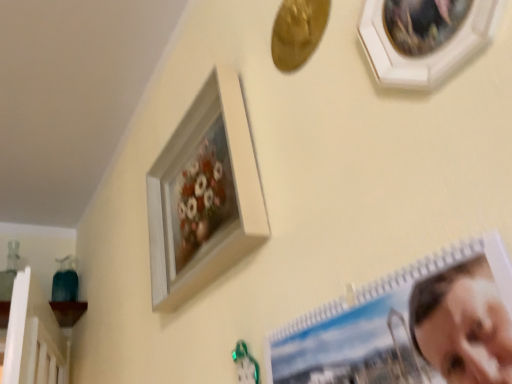
This screenshot has width=512, height=384. Identify the location of spiral-bound photo album at lower right, arranged as the first picture frame when viewed from the front. (410, 326).

This screenshot has width=512, height=384. I want to click on white wooden picture frame at upper right, which appears as the 2th picture frame when viewed from the front, so click(426, 54).

Identify the location of spiral-bound photo album at lower right, arranged as the first picture frame when viewed from the front. (x=410, y=326).

Is white matte picture frame at upper center, which ranks as the 1th picture frame in back-to-front order, outside of spiral-bound photo album at lower right, arranged as the first picture frame when viewed from the front?

Indeed, white matte picture frame at upper center, which ranks as the 1th picture frame in back-to-front order, is completely outside spiral-bound photo album at lower right, arranged as the first picture frame when viewed from the front.

Are white matte picture frame at upper center, the 3th picture frame in the front-to-back sequence, and spiral-bound photo album at lower right, arranged as the first picture frame when viewed from the front, located far from each other?

No, white matte picture frame at upper center, the 3th picture frame in the front-to-back sequence, is not far from spiral-bound photo album at lower right, arranged as the first picture frame when viewed from the front.

Is the position of white matte picture frame at upper center, which ranks as the 1th picture frame in back-to-front order, less distant than that of spiral-bound photo album at lower right, arranged as the first picture frame when viewed from the front?

No, the depth of white matte picture frame at upper center, which ranks as the 1th picture frame in back-to-front order, is greater than that of spiral-bound photo album at lower right, arranged as the first picture frame when viewed from the front.

Between white matte picture frame at upper center, which ranks as the 1th picture frame in back-to-front order, and spiral-bound photo album at lower right, arranged as the first picture frame when viewed from the front, which one has less height?

white matte picture frame at upper center, which ranks as the 1th picture frame in back-to-front order, is shorter.

Is there a large distance between white matte picture frame at upper center, which ranks as the 1th picture frame in back-to-front order, and white wooden picture frame at upper right, which appears as the 2th picture frame when viewed from the front?

They are positioned close to each other.

In the scene shown: From a real-world perspective, between white matte picture frame at upper center, which ranks as the 1th picture frame in back-to-front order, and white wooden picture frame at upper right, the second picture frame when ordered from back to front, who is vertically higher?

In real-world perspective, white matte picture frame at upper center, which ranks as the 1th picture frame in back-to-front order, is above.

From the image's perspective, between white matte picture frame at upper center, which ranks as the 1th picture frame in back-to-front order, and white wooden picture frame at upper right, the second picture frame when ordered from back to front, which one is located above?

white wooden picture frame at upper right, the second picture frame when ordered from back to front, is shown above in the image.

Which of these two, white matte picture frame at upper center, the 3th picture frame in the front-to-back sequence, or white wooden picture frame at upper right, the second picture frame when ordered from back to front, is bigger?

Bigger between the two is white matte picture frame at upper center, the 3th picture frame in the front-to-back sequence.

Considering the relative sizes of white wooden picture frame at upper right, which appears as the 2th picture frame when viewed from the front, and spiral-bound photo album at lower right, arranged as the first picture frame when viewed from the front, in the image provided, is white wooden picture frame at upper right, which appears as the 2th picture frame when viewed from the front, wider than spiral-bound photo album at lower right, arranged as the first picture frame when viewed from the front,?

No.

Considering the sizes of objects white wooden picture frame at upper right, which appears as the 2th picture frame when viewed from the front, and spiral-bound photo album at lower right, placed as the third picture frame when sorted from back to front, in the image provided, who is smaller, white wooden picture frame at upper right, which appears as the 2th picture frame when viewed from the front, or spiral-bound photo album at lower right, placed as the third picture frame when sorted from back to front,?

With smaller size is white wooden picture frame at upper right, which appears as the 2th picture frame when viewed from the front.

The height and width of the screenshot is (384, 512). There is a spiral-bound photo album at lower right, arranged as the first picture frame when viewed from the front. Identify the location of the 2nd picture frame above it (from the image's perspective). (426, 54).

Is point (402, 67) behind point (383, 315)?

That is True.

From a real-world perspective, which object rests below the other?

From a 3D spatial view, spiral-bound photo album at lower right, arranged as the first picture frame when viewed from the front, is below.

Is spiral-bound photo album at lower right, placed as the third picture frame when sorted from back to front, bigger than white wooden picture frame at upper right, the second picture frame when ordered from back to front?

Correct, spiral-bound photo album at lower right, placed as the third picture frame when sorted from back to front, is larger in size than white wooden picture frame at upper right, the second picture frame when ordered from back to front.

Considering the relative positions of spiral-bound photo album at lower right, placed as the third picture frame when sorted from back to front, and white wooden picture frame at upper right, which appears as the 2th picture frame when viewed from the front, in the image provided, is spiral-bound photo album at lower right, placed as the third picture frame when sorted from back to front, to the right of white wooden picture frame at upper right, which appears as the 2th picture frame when viewed from the front, from the viewer's perspective?

Incorrect, spiral-bound photo album at lower right, placed as the third picture frame when sorted from back to front, is not on the right side of white wooden picture frame at upper right, which appears as the 2th picture frame when viewed from the front.

Does spiral-bound photo album at lower right, arranged as the first picture frame when viewed from the front, have a lesser height compared to white wooden picture frame at upper right, the second picture frame when ordered from back to front?

No.

Are spiral-bound photo album at lower right, placed as the third picture frame when sorted from back to front, and white matte picture frame at upper center, the 3th picture frame in the front-to-back sequence, making contact?

There is a gap between spiral-bound photo album at lower right, placed as the third picture frame when sorted from back to front, and white matte picture frame at upper center, the 3th picture frame in the front-to-back sequence.

From the image's perspective, would you say spiral-bound photo album at lower right, placed as the third picture frame when sorted from back to front, is shown under white matte picture frame at upper center, the 3th picture frame in the front-to-back sequence?

Correct, spiral-bound photo album at lower right, placed as the third picture frame when sorted from back to front, appears lower than white matte picture frame at upper center, the 3th picture frame in the front-to-back sequence, in the image.

Looking at their sizes, would you say spiral-bound photo album at lower right, placed as the third picture frame when sorted from back to front, is wider or thinner than white matte picture frame at upper center, which ranks as the 1th picture frame in back-to-front order?

Considering their sizes, spiral-bound photo album at lower right, placed as the third picture frame when sorted from back to front, looks slimmer than white matte picture frame at upper center, which ranks as the 1th picture frame in back-to-front order.

From their relative heights in the image, would you say spiral-bound photo album at lower right, placed as the third picture frame when sorted from back to front, is taller or shorter than white matte picture frame at upper center, which ranks as the 1th picture frame in back-to-front order?

Considering their sizes, spiral-bound photo album at lower right, placed as the third picture frame when sorted from back to front, has more height than white matte picture frame at upper center, which ranks as the 1th picture frame in back-to-front order.

Is white wooden picture frame at upper right, the second picture frame when ordered from back to front, to the left of white matte picture frame at upper center, the 3th picture frame in the front-to-back sequence, from the viewer's perspective?

Incorrect, white wooden picture frame at upper right, the second picture frame when ordered from back to front, is not on the left side of white matte picture frame at upper center, the 3th picture frame in the front-to-back sequence.

Can you see white wooden picture frame at upper right, the second picture frame when ordered from back to front, touching white matte picture frame at upper center, which ranks as the 1th picture frame in back-to-front order?

white wooden picture frame at upper right, the second picture frame when ordered from back to front, and white matte picture frame at upper center, which ranks as the 1th picture frame in back-to-front order, are not in contact.

Does white wooden picture frame at upper right, which appears as the 2th picture frame when viewed from the front, have a greater height compared to white matte picture frame at upper center, which ranks as the 1th picture frame in back-to-front order?

No, white wooden picture frame at upper right, which appears as the 2th picture frame when viewed from the front, is not taller than white matte picture frame at upper center, which ranks as the 1th picture frame in back-to-front order.

Is the depth of white wooden picture frame at upper right, which appears as the 2th picture frame when viewed from the front, less than that of white matte picture frame at upper center, the 3th picture frame in the front-to-back sequence?

Yes, white wooden picture frame at upper right, which appears as the 2th picture frame when viewed from the front, is closer to the viewer.

Identify the location of picture frame located below the white matte picture frame at upper center, which ranks as the 1th picture frame in back-to-front order (from the image's perspective). This screenshot has width=512, height=384. (410, 326).

The height and width of the screenshot is (384, 512). What are the coordinates of `picture frame behind the white wooden picture frame at upper right, which appears as the 2th picture frame when viewed from the front` in the screenshot? It's located at (204, 194).

From the image, which object appears to be nearer to spiral-bound photo album at lower right, arranged as the first picture frame when viewed from the front, white matte picture frame at upper center, which ranks as the 1th picture frame in back-to-front order, or white wooden picture frame at upper right, which appears as the 2th picture frame when viewed from the front?

Based on the image, white wooden picture frame at upper right, which appears as the 2th picture frame when viewed from the front, appears to be nearer to spiral-bound photo album at lower right, arranged as the first picture frame when viewed from the front.

Based on their spatial positions, is spiral-bound photo album at lower right, placed as the third picture frame when sorted from back to front, or white matte picture frame at upper center, which ranks as the 1th picture frame in back-to-front order, further from white wooden picture frame at upper right, which appears as the 2th picture frame when viewed from the front?

white matte picture frame at upper center, which ranks as the 1th picture frame in back-to-front order.

Estimate the real-world distances between objects in this image. Which object is closer to white matte picture frame at upper center, the 3th picture frame in the front-to-back sequence, white wooden picture frame at upper right, which appears as the 2th picture frame when viewed from the front, or spiral-bound photo album at lower right, placed as the third picture frame when sorted from back to front?

The object closer to white matte picture frame at upper center, the 3th picture frame in the front-to-back sequence, is spiral-bound photo album at lower right, placed as the third picture frame when sorted from back to front.

From the image, which object appears to be farther from spiral-bound photo album at lower right, placed as the third picture frame when sorted from back to front, white wooden picture frame at upper right, the second picture frame when ordered from back to front, or white matte picture frame at upper center, which ranks as the 1th picture frame in back-to-front order?

Based on the image, white matte picture frame at upper center, which ranks as the 1th picture frame in back-to-front order, appears to be further to spiral-bound photo album at lower right, placed as the third picture frame when sorted from back to front.

From the image, which object appears to be nearer to white wooden picture frame at upper right, which appears as the 2th picture frame when viewed from the front, white matte picture frame at upper center, the 3th picture frame in the front-to-back sequence, or spiral-bound photo album at lower right, arranged as the first picture frame when viewed from the front?

spiral-bound photo album at lower right, arranged as the first picture frame when viewed from the front.

From the image, which object appears to be nearer to white matte picture frame at upper center, the 3th picture frame in the front-to-back sequence, spiral-bound photo album at lower right, arranged as the first picture frame when viewed from the front, or white wooden picture frame at upper right, the second picture frame when ordered from back to front?

Among the two, spiral-bound photo album at lower right, arranged as the first picture frame when viewed from the front, is located nearer to white matte picture frame at upper center, the 3th picture frame in the front-to-back sequence.

Find the location of a particular element. picture frame between white wooden picture frame at upper right, which appears as the 2th picture frame when viewed from the front, and spiral-bound photo album at lower right, placed as the third picture frame when sorted from back to front, from top to bottom is located at coordinates (204, 194).